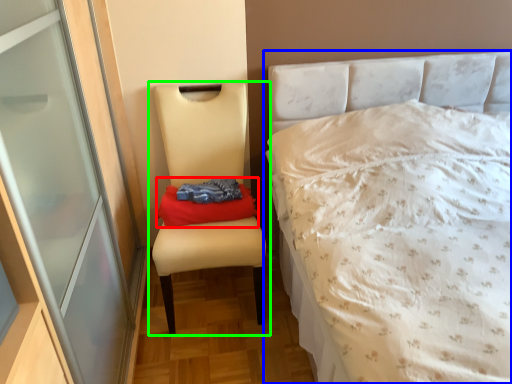
Question: Which object is positioned farthest from material (highlighted by a red box)? Select from bed (highlighted by a blue box) and chair (highlighted by a green box).

Choices:
 (A) bed
 (B) chair

Answer: (A)